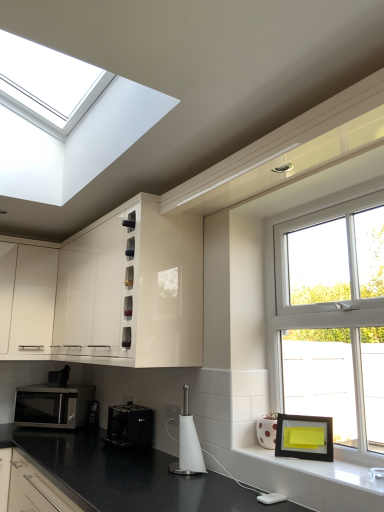
This screenshot has width=384, height=512. What do you see at coordinates (108, 292) in the screenshot?
I see `glossy white cabinet at upper center, which is the second cabinetry from left to right` at bounding box center [108, 292].

Locate an element on the screen. Image resolution: width=384 pixels, height=512 pixels. white glossy window sill at lower right is located at coordinates (327, 466).

Locate an element on the screen. black plastic toaster at lower center, placed as the 3th appliance when sorted from right to left is located at coordinates (93, 414).

From a real-world perspective, is black matte picture frame at lower right on top of white glossy cabinet at left, positioned as the first cabinetry in left-to-right order?

No, from a real-world perspective, black matte picture frame at lower right is not over white glossy cabinet at left, positioned as the first cabinetry in left-to-right order

Is the depth of black matte picture frame at lower right less than that of white glossy cabinet at left, positioned as the first cabinetry in left-to-right order?

That is True.

In the image, there is a white glossy cabinet at left, acting as the second cabinetry starting from the right. Where is `picture frame below it (from the image's perspective)`? This screenshot has width=384, height=512. picture frame below it (from the image's perspective) is located at coordinates (304, 437).

Consider the image. Considering the relative sizes of black matte picture frame at lower right and white glossy cabinet at left, positioned as the first cabinetry in left-to-right order, in the image provided, is black matte picture frame at lower right thinner than white glossy cabinet at left, positioned as the first cabinetry in left-to-right order,?

Yes, black matte picture frame at lower right is thinner than white glossy cabinet at left, positioned as the first cabinetry in left-to-right order.

Considering the sizes of objects white glossy cabinet at left, positioned as the first cabinetry in left-to-right order, and white glossy electric outlet at center, placed as the 1th electric outlet when sorted from top to bottom, in the image provided, who is thinner, white glossy cabinet at left, positioned as the first cabinetry in left-to-right order, or white glossy electric outlet at center, placed as the 1th electric outlet when sorted from top to bottom,?

white glossy electric outlet at center, placed as the 1th electric outlet when sorted from top to bottom.

Does white glossy cabinet at left, positioned as the first cabinetry in left-to-right order, appear on the left side of white glossy electric outlet at center, acting as the first electric outlet starting from the right?

Yes, white glossy cabinet at left, positioned as the first cabinetry in left-to-right order, is to the left of white glossy electric outlet at center, acting as the first electric outlet starting from the right.

From a real-world perspective, is white glossy cabinet at left, acting as the second cabinetry starting from the right, located higher than white glossy electric outlet at center, placed as the second electric outlet when sorted from bottom to top?

Yes.

How distant is white glossy cabinet at left, positioned as the first cabinetry in left-to-right order, from white glossy electric outlet at center, the first electric outlet from the front?

white glossy cabinet at left, positioned as the first cabinetry in left-to-right order, is 4.14 feet away from white glossy electric outlet at center, the first electric outlet from the front.

Can you confirm if black plastic toaster at lower center, the 2th appliance positioned from the back, is thinner than white paper towel holder at center, arranged as the third appliance when viewed from the back?

Incorrect, the width of black plastic toaster at lower center, the 2th appliance positioned from the back, is not less than that of white paper towel holder at center, arranged as the third appliance when viewed from the back.

I want to click on the 1st appliance behind the white paper towel holder at center, the third appliance positioned from the left, counting from the anchor's position, so click(x=129, y=426).

From a real-world perspective, relative to white paper towel holder at center, which appears as the 1th appliance when viewed from the right, is black plastic toaster at lower center, positioned as the second appliance in front-to-back order, vertically above or below?

black plastic toaster at lower center, positioned as the second appliance in front-to-back order, is below white paper towel holder at center, which appears as the 1th appliance when viewed from the right.

Is black plastic toaster at lower center, positioned as the second appliance in front-to-back order, looking in the opposite direction of white paper towel holder at center, the third appliance positioned from the left?

No, white paper towel holder at center, the third appliance positioned from the left, is not at the back of black plastic toaster at lower center, positioned as the second appliance in front-to-back order.

In the scene shown: Does glossy white cabinet at upper center, which is the second cabinetry from left to right, come behind white paper towel holder at center, the third appliance positioned from the left?

Yes.

Who is taller, glossy white cabinet at upper center, which is the first cabinetry in right-to-left order, or white paper towel holder at center, which appears as the 1th appliance when viewed from the right?

glossy white cabinet at upper center, which is the first cabinetry in right-to-left order, is taller.

Identify the location of the 2nd cabinetry positioned above the white paper towel holder at center, which appears as the 1th appliance when viewed from the right (from the image's perspective). (108, 292).

Who is smaller, glossy white cabinet at upper center, which is the second cabinetry from left to right, or white paper towel holder at center, the third appliance positioned from the left?

With smaller size is white paper towel holder at center, the third appliance positioned from the left.

Which is behind, point (331, 433) or point (284, 459)?

The point (331, 433) is farther from the camera.

Are black matte picture frame at lower right and white glossy window sill at lower right making contact?

Absolutely, black matte picture frame at lower right is next to and touching white glossy window sill at lower right.

Is black matte picture frame at lower right taller than white glossy window sill at lower right?

Correct, black matte picture frame at lower right is much taller as white glossy window sill at lower right.

Measure the distance from black matte picture frame at lower right to white glossy window sill at lower right.

black matte picture frame at lower right and white glossy window sill at lower right are 3.93 inches apart from each other.

Based on their positions, is white paper towel holder at center, the third appliance positioned from the left, located to the left or right of glossy white cabinet at upper center, which is the first cabinetry in right-to-left order?

Clearly, white paper towel holder at center, the third appliance positioned from the left, is on the right of glossy white cabinet at upper center, which is the first cabinetry in right-to-left order, in the image.

Can you tell me how much white paper towel holder at center, which appears as the 1th appliance when viewed from the front, and glossy white cabinet at upper center, which is the second cabinetry from left to right, differ in facing direction?

The facing directions of white paper towel holder at center, which appears as the 1th appliance when viewed from the front, and glossy white cabinet at upper center, which is the second cabinetry from left to right, are 0.0159 degrees apart.

Between white paper towel holder at center, which appears as the 1th appliance when viewed from the right, and glossy white cabinet at upper center, which is the second cabinetry from left to right, which one has more height?

With more height is glossy white cabinet at upper center, which is the second cabinetry from left to right.

How different are the orientations of white paper towel holder at center, arranged as the third appliance when viewed from the back, and silver metallic microwave at lower left in degrees?

42.5 degrees separate the facing orientations of white paper towel holder at center, arranged as the third appliance when viewed from the back, and silver metallic microwave at lower left.

From the image's perspective, which one is positioned higher, white paper towel holder at center, which appears as the 1th appliance when viewed from the right, or silver metallic microwave at lower left?

white paper towel holder at center, which appears as the 1th appliance when viewed from the right, from the image's perspective.

Does white paper towel holder at center, arranged as the third appliance when viewed from the back, turn towards silver metallic microwave at lower left?

No, white paper towel holder at center, arranged as the third appliance when viewed from the back, is not turned towards silver metallic microwave at lower left.

This screenshot has width=384, height=512. I want to click on picture frame below the white glossy cabinet at left, positioned as the first cabinetry in left-to-right order (from a real-world perspective), so click(304, 437).

Where is `the 1st electric outlet below when counting from the white glossy cabinet at left, positioned as the first cabinetry in left-to-right order (from the image's perspective)`? the 1st electric outlet below when counting from the white glossy cabinet at left, positioned as the first cabinetry in left-to-right order (from the image's perspective) is located at coordinates (173, 414).

From the image, which object appears to be nearer to white glossy electric outlet at lower center, which is the 2th electric outlet in right-to-left order, black plastic toaster at lower center, placed as the 3th appliance when sorted from right to left, or glossy white cabinet at upper center, which is the second cabinetry from left to right?

black plastic toaster at lower center, placed as the 3th appliance when sorted from right to left.

In the scene shown: Considering their positions, is silver metallic microwave at lower left positioned further to black matte picture frame at lower right than black plastic toaster at lower center, placed as the 3th appliance when sorted from right to left?

The object further to black matte picture frame at lower right is silver metallic microwave at lower left.

Estimate the real-world distances between objects in this image. Which object is closer to glossy white cabinet at upper center, which is the first cabinetry in right-to-left order, white paper towel holder at center, arranged as the third appliance when viewed from the back, or white glossy electric outlet at center, acting as the first electric outlet starting from the right?

Among the two, white paper towel holder at center, arranged as the third appliance when viewed from the back, is located nearer to glossy white cabinet at upper center, which is the first cabinetry in right-to-left order.

Looking at the image, which one is located further to white glossy electric outlet at lower center, the 1th electric outlet in the bottom-to-top sequence, black plastic toaster at lower center, the first appliance from the left, or white glossy electric outlet at center, the first electric outlet from the front?

white glossy electric outlet at center, the first electric outlet from the front, is further to white glossy electric outlet at lower center, the 1th electric outlet in the bottom-to-top sequence.

Which object lies nearer to the anchor point white glossy electric outlet at center, arranged as the 2th electric outlet when viewed from the back, silver metallic microwave at lower left or white glossy window sill at lower right?

The object closer to white glossy electric outlet at center, arranged as the 2th electric outlet when viewed from the back, is white glossy window sill at lower right.

When comparing their distances from white glossy electric outlet at center, placed as the second electric outlet when sorted from bottom to top, does white glossy cabinet at left, acting as the second cabinetry starting from the right, or black plastic toaster at lower center, the 2th appliance positioned from the back, seem closer?

Based on the image, black plastic toaster at lower center, the 2th appliance positioned from the back, appears to be nearer to white glossy electric outlet at center, placed as the second electric outlet when sorted from bottom to top.

Looking at the image, which one is located closer to glossy white cabinet at upper center, which is the first cabinetry in right-to-left order, black matte picture frame at lower right or white glossy electric outlet at lower center, the 1th electric outlet viewed from the left?

white glossy electric outlet at lower center, the 1th electric outlet viewed from the left, is positioned closer to the anchor glossy white cabinet at upper center, which is the first cabinetry in right-to-left order.

Consider the image. Which object lies further to the anchor point black matte picture frame at lower right, white paper towel holder at center, the third appliance positioned from the left, or glossy white cabinet at upper center, which is the first cabinetry in right-to-left order?

glossy white cabinet at upper center, which is the first cabinetry in right-to-left order, is further to black matte picture frame at lower right.

This screenshot has height=512, width=384. Identify the location of picture frame positioned between white glossy window sill at lower right and white glossy electric outlet at center, acting as the first electric outlet starting from the right, from near to far. (304, 437).

Where is `cabinetry located between glossy white cabinet at upper center, which is the first cabinetry in right-to-left order, and silver metallic microwave at lower left in the depth direction`? Image resolution: width=384 pixels, height=512 pixels. cabinetry located between glossy white cabinet at upper center, which is the first cabinetry in right-to-left order, and silver metallic microwave at lower left in the depth direction is located at coordinates (27, 298).

The image size is (384, 512). Identify the location of cabinetry situated between silver metallic microwave at lower left and black matte picture frame at lower right from left to right. (108, 292).

Where is `microwave oven between white paper towel holder at center, which appears as the 1th appliance when viewed from the right, and black plastic toaster at lower center, the first appliance from the left, along the z-axis`? This screenshot has width=384, height=512. microwave oven between white paper towel holder at center, which appears as the 1th appliance when viewed from the right, and black plastic toaster at lower center, the first appliance from the left, along the z-axis is located at coordinates (53, 405).